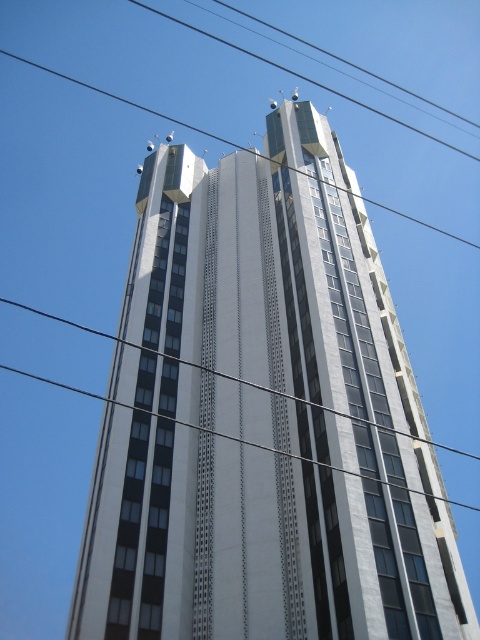
What are the coordinates of the white glass building at center?

The white glass building at center is located at coordinates point (264, 419).

You are an electrician inspecting the building. You notice two wires near the top of the building. One is a metallic wire at center and the other is a black wire at upper center. Which wire is located to the right of the other?

The metallic wire at center is positioned on the right side of black wire at upper center.

You are an electrician inspecting the building. You notice two wires on the building facade. The metallic wire at center and the black wire at upper center. Which one is thinner?

The metallic wire at center has a lesser width compared to the black wire at upper center, so the metallic wire at center is thinner.